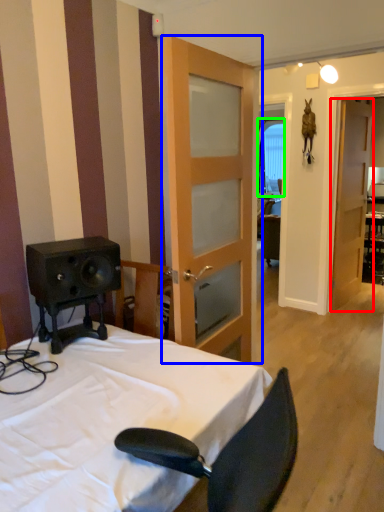
Question: Which object is the farthest from door (highlighted by a red box)? Choose among these: door (highlighted by a blue box) or window (highlighted by a green box).

Choices:
 (A) door
 (B) window

Answer: (A)